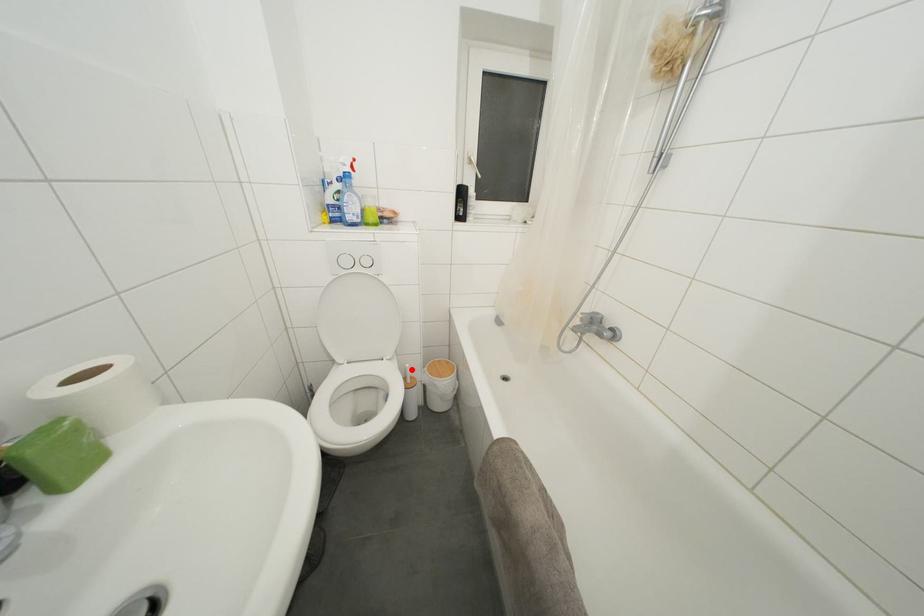
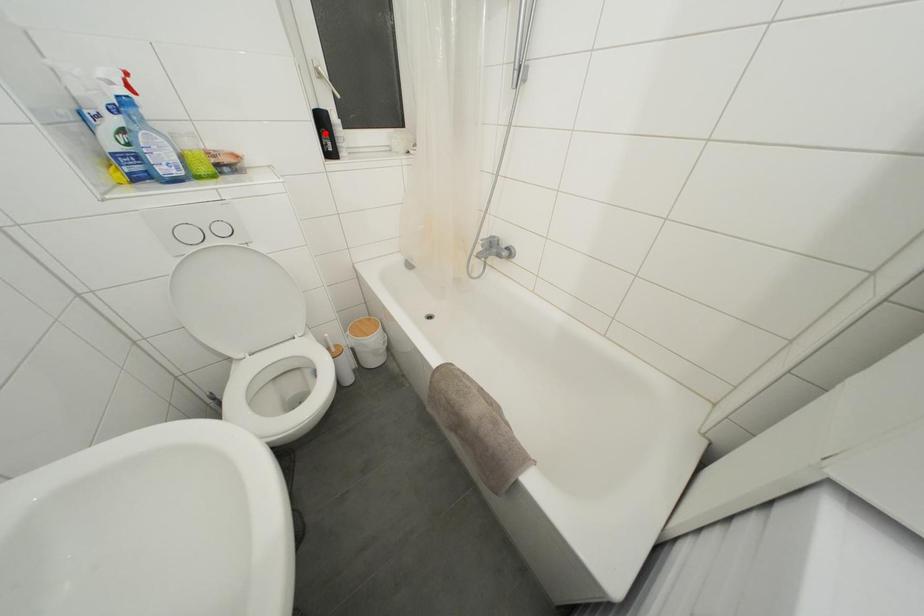
I am providing you with two images of the same scene from different viewpoints. A red point is marked on the first image and another point is marked on the second image. Does the point marked in image1 correspond to the same location as the one in image2?

No